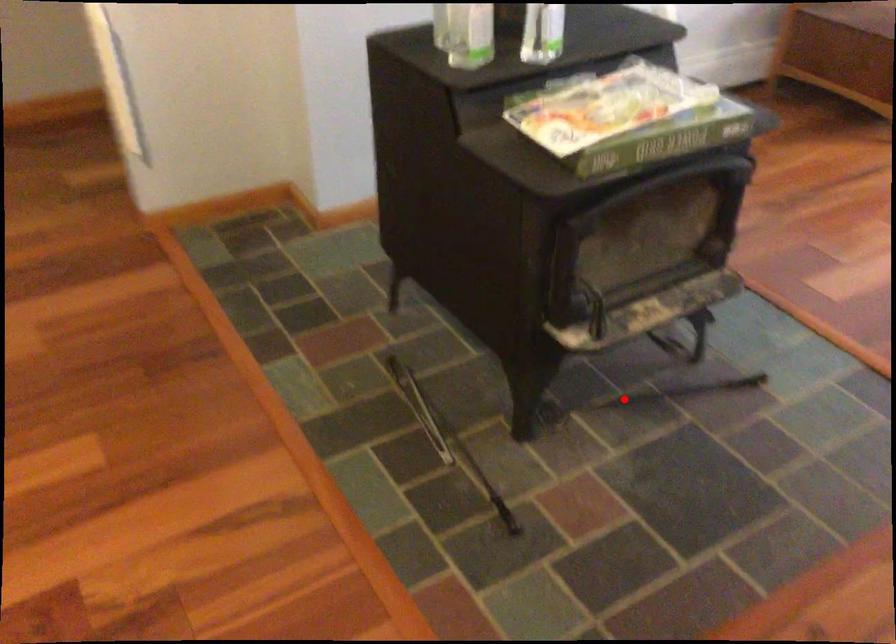
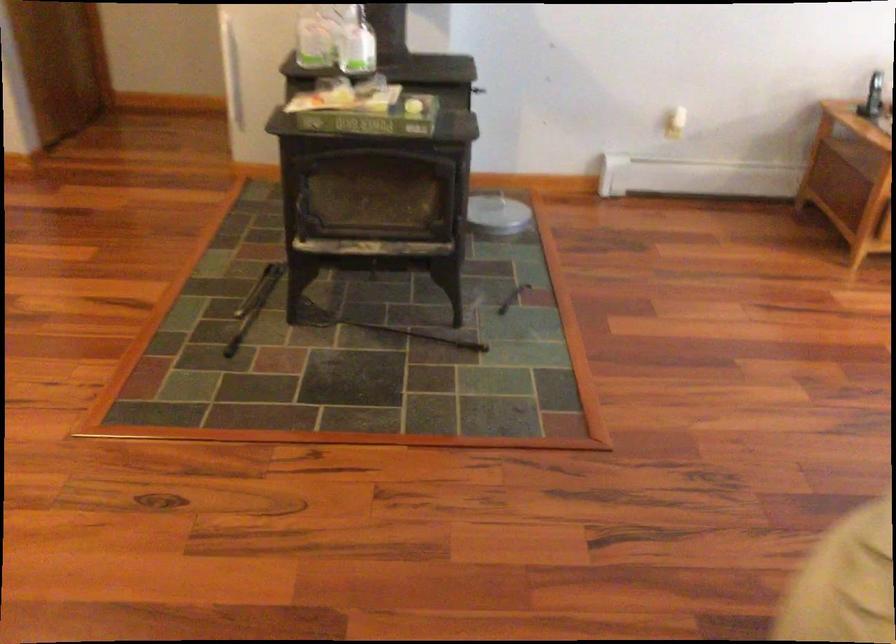
Question: I am providing you with two images of the same scene from different viewpoints. Image1 has a red point marked. In image2, the corresponding 3D location appears at what relative position? Reply with the corresponding letter.

Choices:
 (A) Closer
 (B) Farther

Answer: (B)